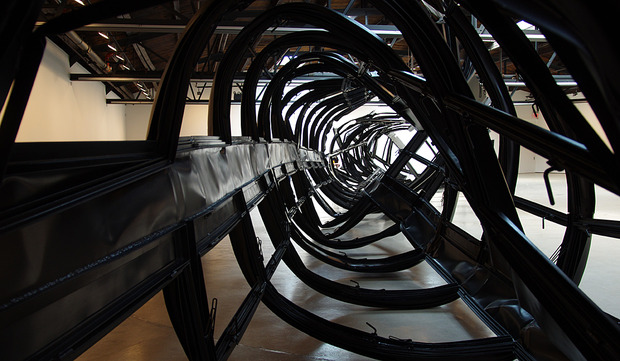
I want to click on the left wall, so click(x=42, y=104).